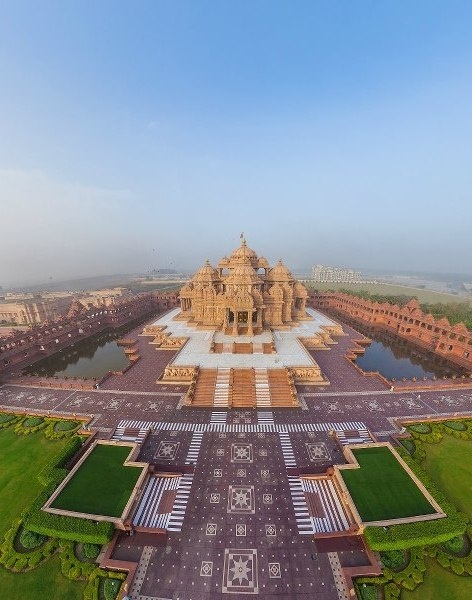
At what (x,y) coordinates should I click in order to perform the action: click on brown stairs. Please return your answer as a coordinate pair (x, y). The height and width of the screenshot is (600, 472). Looking at the image, I should click on (281, 398).